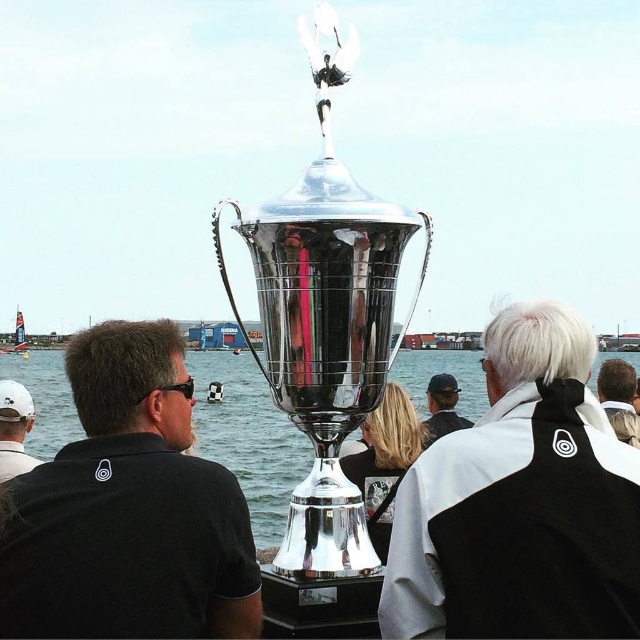
Consider the image. Is shiny silver trophy at center above light brown hair at center?

Incorrect, shiny silver trophy at center is not positioned above light brown hair at center.

Can you confirm if shiny silver trophy at center is wider than light brown hair at center?

Yes, shiny silver trophy at center is wider than light brown hair at center.

Which is behind, point (260, 428) or point (605, 360)?

Point (260, 428)

You are a GUI agent. You are given a task and a screenshot of the screen. Output one action in this format:
    pyautogui.click(x=<x>, y=<y>)
    Task: Click on the shiny silver trophy at center
    Image resolution: width=640 pixels, height=640 pixels.
    Given the screenshot: What is the action you would take?
    pyautogui.click(x=248, y=436)

Which is below, black matte shirt at center or polished silver trophy at center?

Positioned lower is black matte shirt at center.

Which of these two, black matte shirt at center or polished silver trophy at center, stands shorter?

black matte shirt at center is shorter.

Locate an element on the screen. black matte shirt at center is located at coordinates (129, 508).

Does point (440, 413) come farther from viewer compared to point (624, 387)?

Yes, point (440, 413) is behind point (624, 387).

Can you confirm if black cap at center is bigger than light brown hair at center?

Incorrect, black cap at center is not larger than light brown hair at center.

Find the location of `black cap at center`. black cap at center is located at coordinates (442, 406).

The image size is (640, 640). In order to click on black cap at center in this screenshot , I will do pyautogui.click(x=442, y=406).